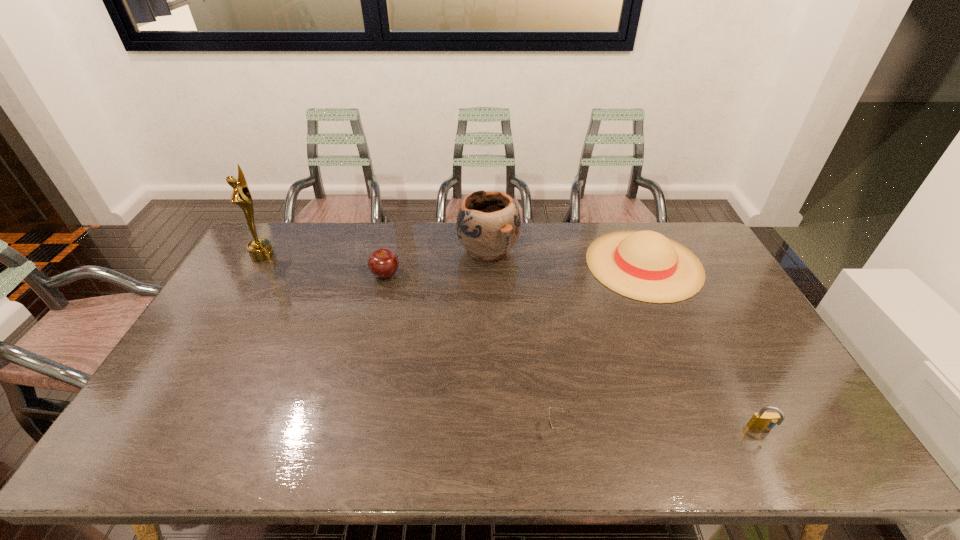
Identify the location of vacant area that lies between the padlock and the sunglasses. (660, 429).

Locate an element on the screen. object that stands as the third closest to the shortest object is located at coordinates (488, 225).

Identify which object is located as the fourth nearest to the award. Please provide its 2D coordinates. Your answer should be formatted as a tuple, i.e. [(x, y)], where the tuple contains the x and y coordinates of a point satisfying the conditions above.

[(645, 265)]

The image size is (960, 540). I want to click on vacant space that satisfies the following two spatial constraints: 1. on the front-facing side of the tallest object; 2. on the back side of the sombrero, so click(x=257, y=264).

Identify the location of vacant space that satisfies the following two spatial constraints: 1. on the front side of the second tallest object; 2. on the front-facing side of the leftmost object. point(489,254).